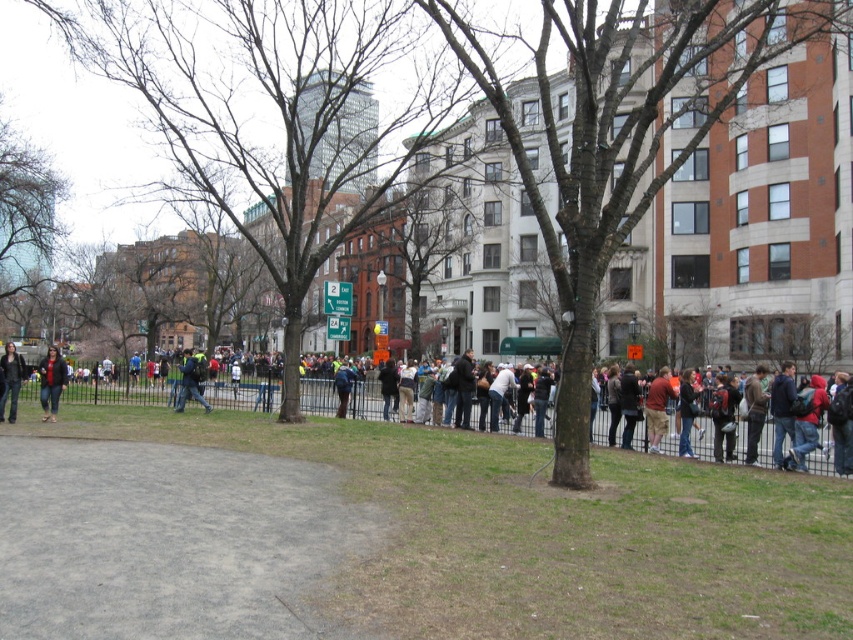
Can you confirm if grassy lawn at center is smaller than dark blue backpack at center?

Indeed, grassy lawn at center has a smaller size compared to dark blue backpack at center.

At what (x,y) coordinates should I click in order to perform the action: click on grassy lawn at center. Please return your answer as a coordinate pair (x, y). The height and width of the screenshot is (640, 853). Looking at the image, I should click on (444, 532).

Which is behind, point (567, 509) or point (184, 353)?

Positioned behind is point (184, 353).

Where is `grassy lawn at center`? grassy lawn at center is located at coordinates (444, 532).

Who is higher up, dark blue backpack at center or blue denim jacket at center?

dark blue backpack at center is higher up.

In the scene shown: Does dark blue backpack at center appear on the left side of blue denim jacket at center?

Correct, you'll find dark blue backpack at center to the left of blue denim jacket at center.

Which is in front, point (186, 392) or point (350, 381)?

Point (186, 392) is more forward.

The width and height of the screenshot is (853, 640). I want to click on dark blue backpack at center, so click(x=190, y=381).

Between dark blue jeans at center and dark blue jacket at right, which one appears on the right side from the viewer's perspective?

From the viewer's perspective, dark blue jacket at right appears more on the right side.

Which is in front, point (831, 456) or point (778, 400)?

Point (778, 400) is in front.

You are a GUI agent. You are given a task and a screenshot of the screen. Output one action in this format:
    pyautogui.click(x=<x>, y=<y>)
    Task: Click on the dark blue jeans at center
    
    Given the screenshot: What is the action you would take?
    pyautogui.click(x=120, y=387)

This screenshot has width=853, height=640. In order to click on dark blue jeans at center in this screenshot , I will do `click(120, 387)`.